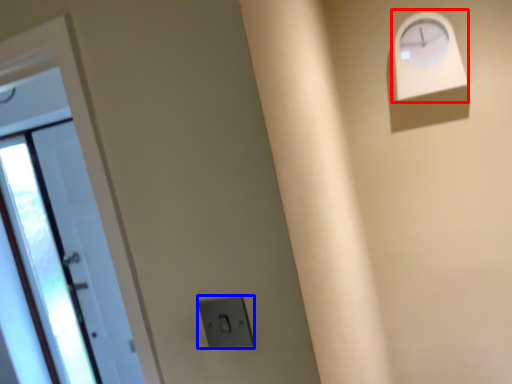
Question: Among these objects, which one is farthest to the camera, clock (highlighted by a red box) or electric outlet (highlighted by a blue box)?

Choices:
 (A) clock
 (B) electric outlet

Answer: (A)